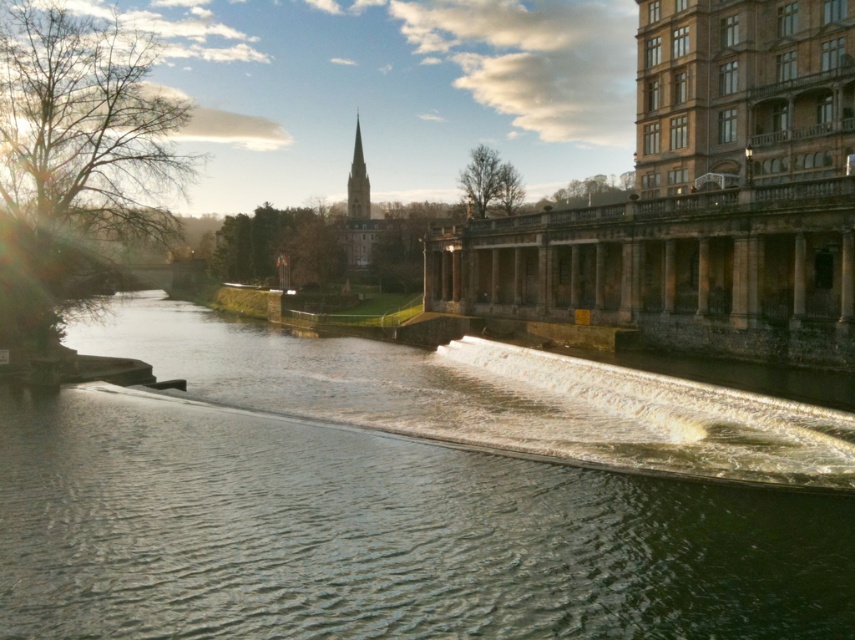
From the picture: You are an architect designing a new riverside building. You want to ensure that the building does not block the view of the greenish water at center from the smooth gray steeple at upper center. Based on the scene, what should you consider about their sizes?

The greenish water at center is wider than the smooth gray steeple at upper center, so the building should be designed in a way that allows the wider greenish water at center to remain visible from the steeple.

You are an architect designing a new riverside building. You want to ensure that the greenish water at center and the smooth gray steeple at upper center are both visible from the main entrance. Given their spatial relationship, which object will take up more visual space in the entrance view?

The smooth gray steeple at upper center occupies more visual space than the greenish water at center because the greenish water at center occupies less space than smooth gray steeple at upper center.

From the picture: You are a tourist standing at the riverside and want to take a photo of the smooth gray steeple at upper center and the greenish water at center. Which object should you point your camera towards first if you want to capture both in one shot?

You should point your camera towards the smooth gray steeple at upper center first because it is above the greenish water at center, so capturing it first ensures both are in frame.